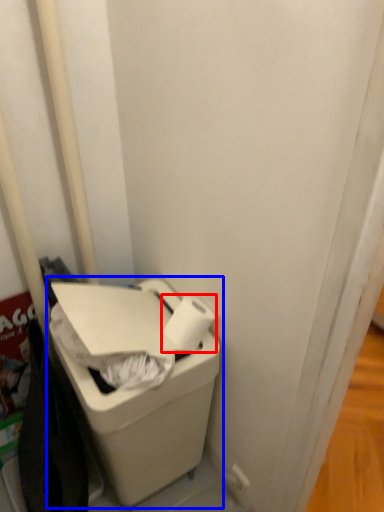
Question: Among these objects, which one is nearest to the camera, toilet paper (highlighted by a red box) or waste container (highlighted by a blue box)?

Choices:
 (A) toilet paper
 (B) waste container

Answer: (B)